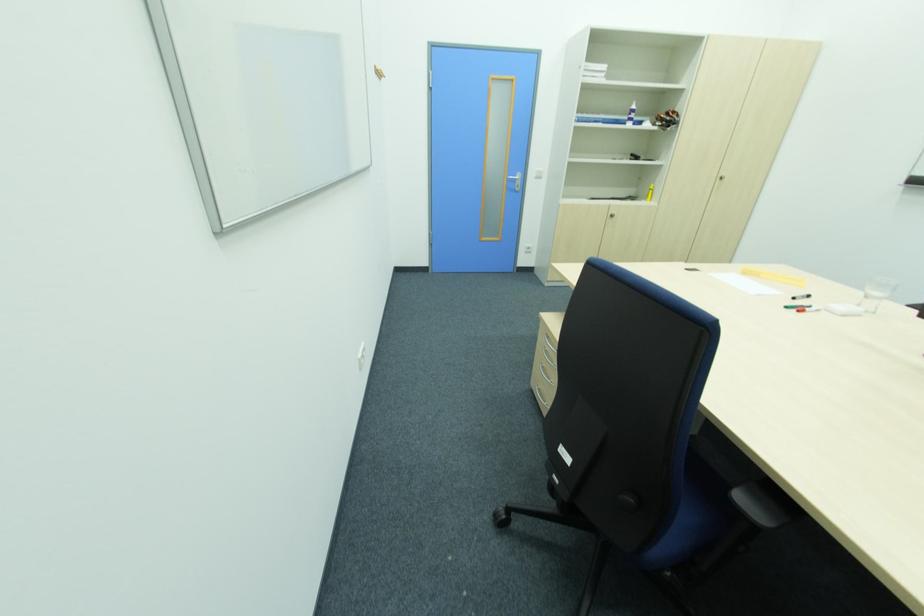
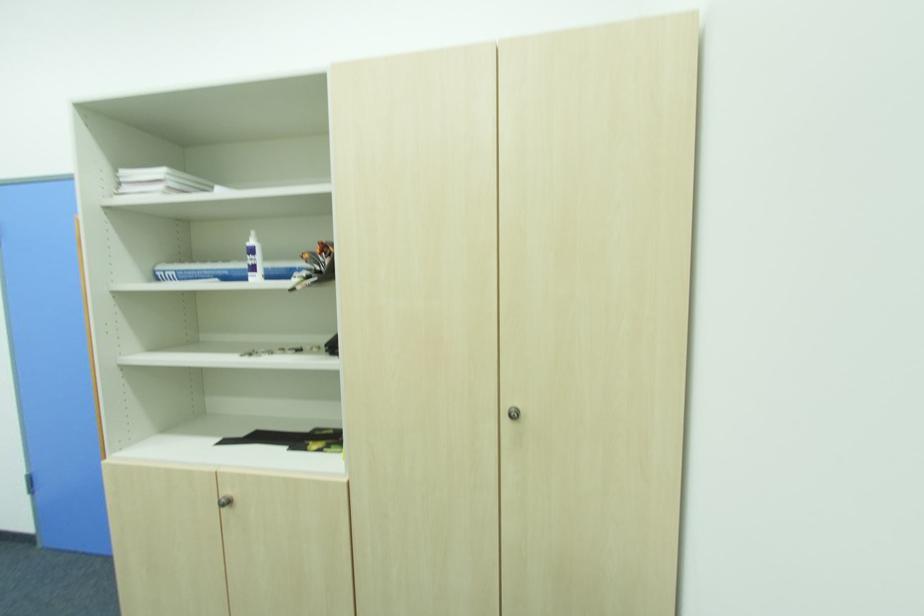
In the second image, find the point that corresponds to point 674,115 in the first image.

(321, 252)